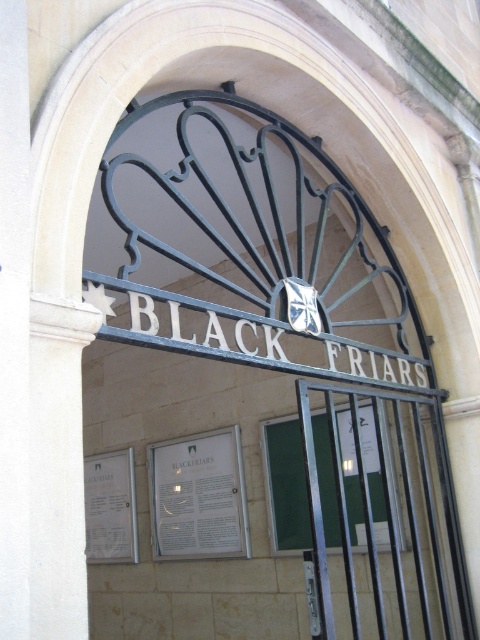
Between white paper sign at center and white paper sign at lower left, which one is positioned higher?

white paper sign at center

Is white paper sign at center closer to camera compared to white paper sign at lower left?

Yes, white paper sign at center is in front of white paper sign at lower left.

The image size is (480, 640). What do you see at coordinates (197, 497) in the screenshot?
I see `white paper sign at center` at bounding box center [197, 497].

Locate an element on the screen. Image resolution: width=480 pixels, height=640 pixels. white paper sign at center is located at coordinates (197, 497).

Can you confirm if black metal gate at center is positioned to the right of white paper sign at center?

Indeed, black metal gate at center is positioned on the right side of white paper sign at center.

Is point (307, 390) behind point (225, 456)?

No, (307, 390) is in front of (225, 456).

Who is more distant from viewer, (332, 387) or (203, 548)?

Point (203, 548)

This screenshot has height=640, width=480. What are the coordinates of `black metal gate at center` in the screenshot? It's located at pos(385,509).

Describe the element at coordinates (385, 509) in the screenshot. The image size is (480, 640). I see `black metal gate at center` at that location.

Is black metal gate at center bigger than white paper sign at lower left?

Indeed, black metal gate at center has a larger size compared to white paper sign at lower left.

Between point (430, 616) and point (91, 500), which one is positioned behind?

The point (91, 500) is more distant.

At what (x,y) coordinates should I click in order to perform the action: click on black metal gate at center. Please return your answer as a coordinate pair (x, y). This screenshot has width=480, height=640. Looking at the image, I should click on (385, 509).